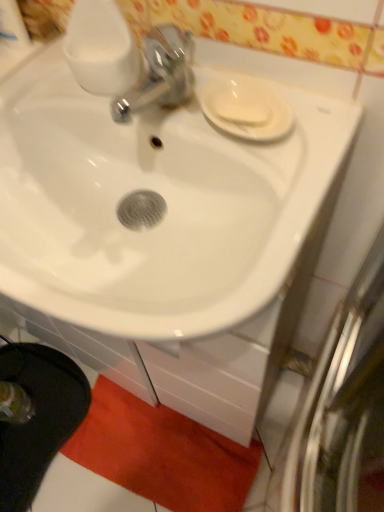
Question: Is white glossy saucer at upper right wider or thinner than orange plush bath mat at lower center?

Choices:
 (A) wide
 (B) thin

Answer: (B)

Question: From the image's perspective, is white glossy saucer at upper right located above or below orange plush bath mat at lower center?

Choices:
 (A) above
 (B) below

Answer: (A)

Question: Which object is positioned closest to the white matte soap at upper right?

Choices:
 (A) white glossy sink at center
 (B) white glossy saucer at upper right
 (C) orange plush bath mat at lower center

Answer: (B)

Question: Which object is the closest to the orange plush bath mat at lower center?

Choices:
 (A) white matte soap at upper right
 (B) white glossy saucer at upper right
 (C) white glossy sink at center

Answer: (C)